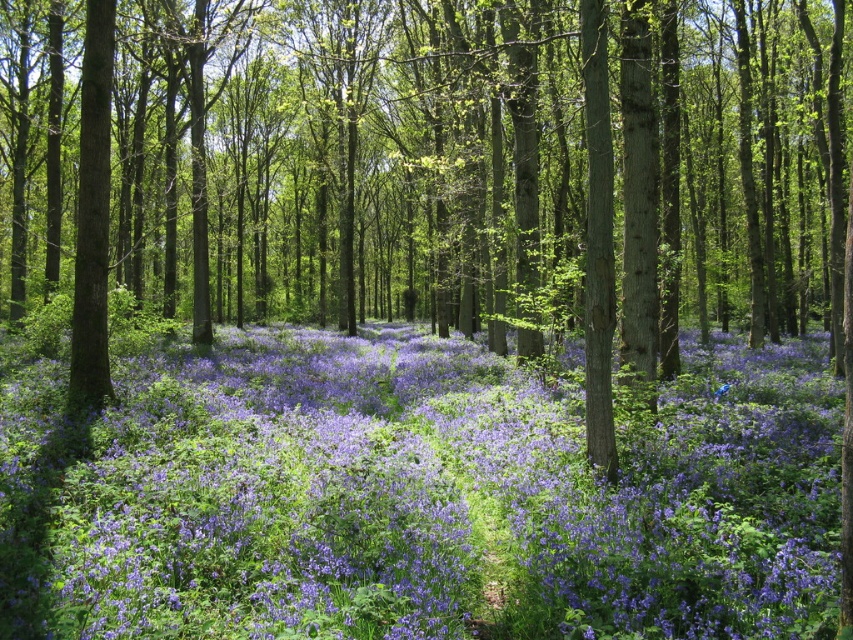
Question: Which point is closer to the camera?

Choices:
 (A) green rough bark tree at center
 (B) purple matte flowers at center

Answer: (A)

Question: Which of the following is the closest to the observer?

Choices:
 (A) green rough bark tree at center
 (B) purple matte flowers at center

Answer: (A)

Question: Can you confirm if green rough bark tree at center is positioned below purple matte flowers at center?

Choices:
 (A) no
 (B) yes

Answer: (A)

Question: Considering the relative positions of green rough bark tree at center and purple matte flowers at center in the image provided, where is green rough bark tree at center located with respect to purple matte flowers at center?

Choices:
 (A) left
 (B) right

Answer: (A)

Question: Is green rough bark tree at center smaller than purple matte flowers at center?

Choices:
 (A) no
 (B) yes

Answer: (A)